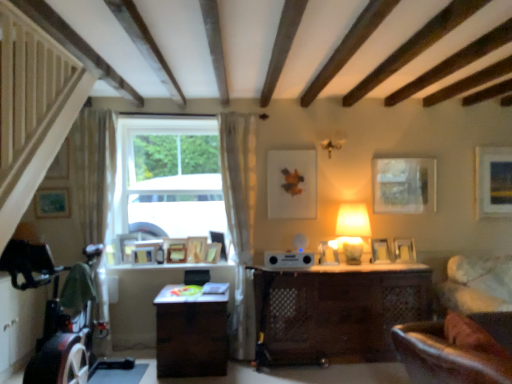
Question: Should I look upward or downward to see matte gold picture frame at upper right, the 1th picture frame positioned from the right?

Choices:
 (A) up
 (B) down

Answer: (A)

Question: Can you confirm if white plastic speaker at center is bigger than wooden picture frame at window, the 10th picture frame viewed from the right?

Choices:
 (A) no
 (B) yes

Answer: (B)

Question: Does white plastic speaker at center appear on the left side of wooden picture frame at window, the 4th picture frame when ordered from left to right?

Choices:
 (A) no
 (B) yes

Answer: (A)

Question: Is white plastic speaker at center positioned with its back to wooden picture frame at window, the 4th picture frame when ordered from left to right?

Choices:
 (A) yes
 (B) no

Answer: (B)

Question: Considering the relative sizes of white plastic speaker at center and wooden picture frame at window, the 4th picture frame when ordered from left to right, in the image provided, is white plastic speaker at center smaller than wooden picture frame at window, the 4th picture frame when ordered from left to right,?

Choices:
 (A) yes
 (B) no

Answer: (B)

Question: From the image's perspective, is white plastic speaker at center located above wooden picture frame at window, the 4th picture frame when ordered from left to right?

Choices:
 (A) no
 (B) yes

Answer: (B)

Question: Considering the relative sizes of white plastic speaker at center and wooden picture frame at window, the 10th picture frame viewed from the right, in the image provided, is white plastic speaker at center shorter than wooden picture frame at window, the 10th picture frame viewed from the right,?

Choices:
 (A) no
 (B) yes

Answer: (B)

Question: Is matte wooden picture frame at center, which ranks as the 5th picture frame in right-to-left order, behind wooden picture frame at center, acting as the 8th picture frame starting from the right?

Choices:
 (A) no
 (B) yes

Answer: (A)

Question: Can you confirm if matte wooden picture frame at center, the 9th picture frame positioned from the left, is bigger than wooden picture frame at center, which is the 6th picture frame from left to right?

Choices:
 (A) yes
 (B) no

Answer: (B)

Question: Can you confirm if matte wooden picture frame at center, which ranks as the 5th picture frame in right-to-left order, is positioned to the right of wooden picture frame at center, acting as the 8th picture frame starting from the right?

Choices:
 (A) yes
 (B) no

Answer: (A)

Question: Is there a large distance between matte wooden picture frame at center, which ranks as the 5th picture frame in right-to-left order, and wooden picture frame at center, which is the 6th picture frame from left to right?

Choices:
 (A) yes
 (B) no

Answer: (A)

Question: Does matte wooden picture frame at center, which ranks as the 5th picture frame in right-to-left order, have a lesser height compared to wooden picture frame at center, acting as the 8th picture frame starting from the right?

Choices:
 (A) no
 (B) yes

Answer: (A)

Question: Considering the relative sizes of matte wooden picture frame at center, the 9th picture frame positioned from the left, and wooden picture frame at center, which is the 6th picture frame from left to right, in the image provided, is matte wooden picture frame at center, the 9th picture frame positioned from the left, taller than wooden picture frame at center, which is the 6th picture frame from left to right,?

Choices:
 (A) no
 (B) yes

Answer: (B)

Question: Considering the relative sizes of matte silver picture frame at right, positioned as the fourth picture frame in right-to-left order, and wooden picture frame at center, which is counted as the sixth picture frame, starting from the right, in the image provided, is matte silver picture frame at right, positioned as the fourth picture frame in right-to-left order, thinner than wooden picture frame at center, which is counted as the sixth picture frame, starting from the right,?

Choices:
 (A) no
 (B) yes

Answer: (A)